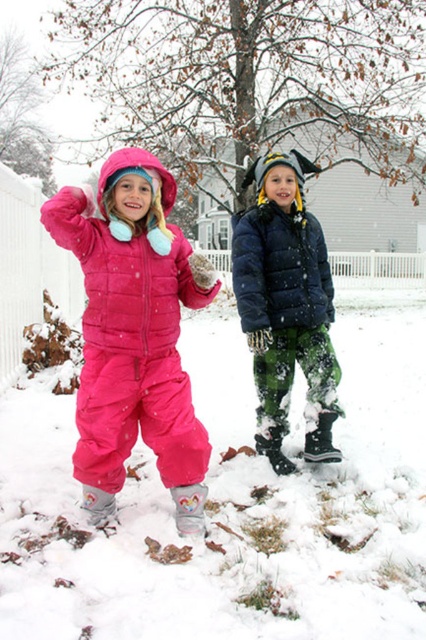
Describe the element at coordinates (134, 333) in the screenshot. I see `pink matte snowsuit at center` at that location.

Is pink matte snowsuit at center wider than matte black jacket at center?

Yes.

Between point (104, 300) and point (328, 448), which one is positioned behind?

Positioned behind is point (328, 448).

You are a GUI agent. You are given a task and a screenshot of the screen. Output one action in this format:
    pyautogui.click(x=<x>, y=<y>)
    Task: Click on the pink matte snowsuit at center
    The image size is (426, 640).
    Given the screenshot: What is the action you would take?
    pyautogui.click(x=134, y=333)